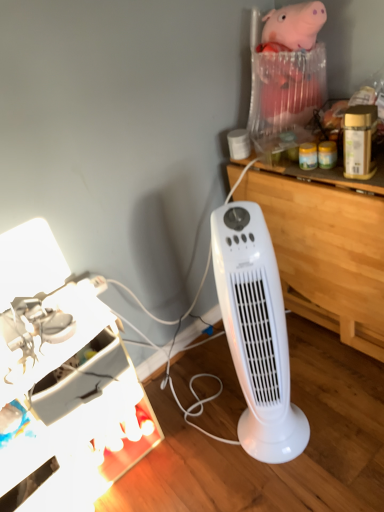
Question: Considering the relative positions of wooden at right and metallic silver desk lamp at lower left in the image provided, is wooden at right to the right of metallic silver desk lamp at lower left from the viewer's perspective?

Choices:
 (A) yes
 (B) no

Answer: (A)

Question: Is the position of wooden at right less distant than that of metallic silver desk lamp at lower left?

Choices:
 (A) yes
 (B) no

Answer: (B)

Question: Is wooden at right taller than metallic silver desk lamp at lower left?

Choices:
 (A) no
 (B) yes

Answer: (B)

Question: Is wooden at right outside metallic silver desk lamp at lower left?

Choices:
 (A) yes
 (B) no

Answer: (A)

Question: Considering the relative sizes of wooden at right and metallic silver desk lamp at lower left in the image provided, is wooden at right bigger than metallic silver desk lamp at lower left?

Choices:
 (A) no
 (B) yes

Answer: (B)

Question: In terms of height, does white plastic tower fan at center look taller or shorter compared to metallic silver desk lamp at lower left?

Choices:
 (A) short
 (B) tall

Answer: (B)

Question: Does point (238, 256) appear closer or farther from the camera than point (1, 372)?

Choices:
 (A) closer
 (B) farther

Answer: (A)

Question: From a real-world perspective, is white plastic tower fan at center positioned above or below metallic silver desk lamp at lower left?

Choices:
 (A) below
 (B) above

Answer: (B)

Question: Based on their sizes in the image, would you say white plastic tower fan at center is bigger or smaller than metallic silver desk lamp at lower left?

Choices:
 (A) big
 (B) small

Answer: (B)

Question: Is metallic silver desk lamp at lower left in front of or behind wooden at right in the image?

Choices:
 (A) behind
 (B) front

Answer: (B)

Question: Considering the positions of point (125, 471) and point (269, 212), is point (125, 471) closer or farther from the camera than point (269, 212)?

Choices:
 (A) closer
 (B) farther

Answer: (A)

Question: Is metallic silver desk lamp at lower left inside or outside of wooden at right?

Choices:
 (A) outside
 (B) inside

Answer: (A)

Question: In terms of size, does metallic silver desk lamp at lower left appear bigger or smaller than wooden at right?

Choices:
 (A) small
 (B) big

Answer: (A)

Question: From a real-world perspective, is wooden at right above or below metallic silver desk lamp at lower left?

Choices:
 (A) below
 (B) above

Answer: (B)

Question: Considering the positions of wooden at right and metallic silver desk lamp at lower left in the image, is wooden at right wider or thinner than metallic silver desk lamp at lower left?

Choices:
 (A) wide
 (B) thin

Answer: (A)